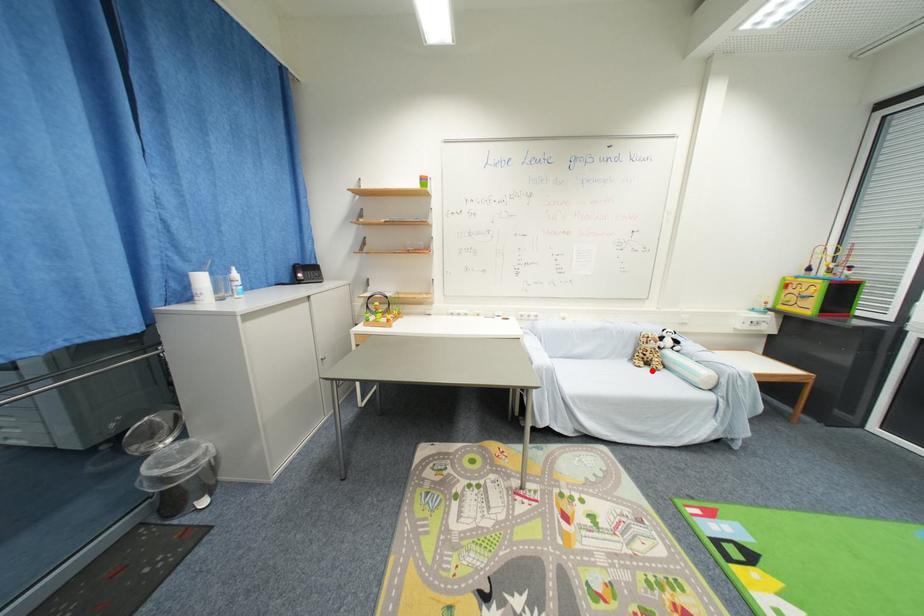
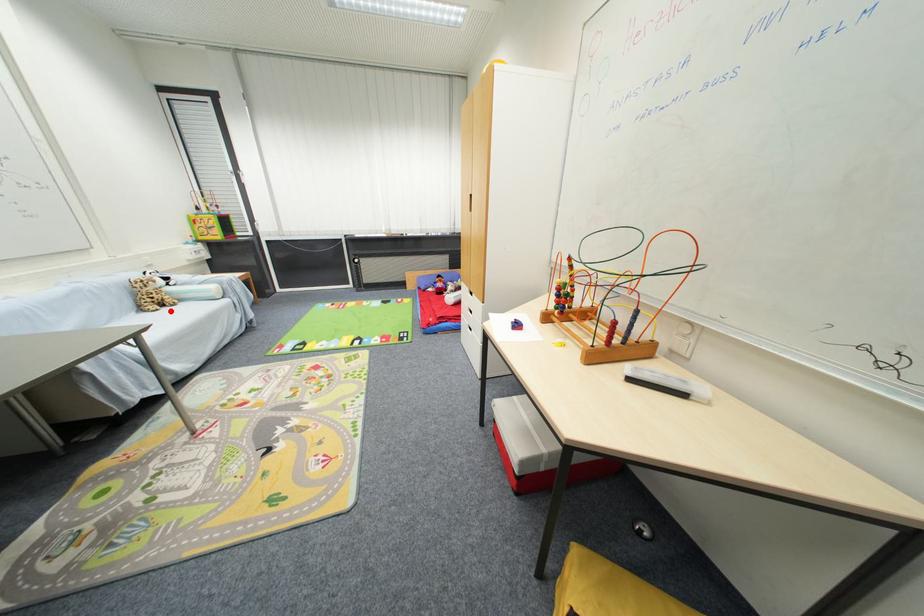
I am providing you with two images of the same scene from different viewpoints. A red point is marked on the first image and another point is marked on the second image. Are the points marked in image1 and image2 representing the same 3D position?

Yes